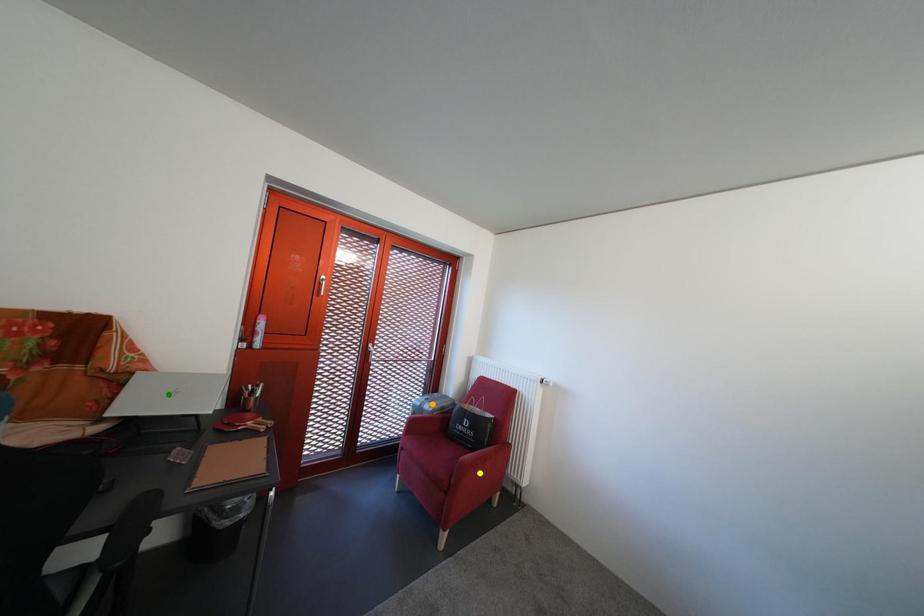
Order these from nearest to farthest:
- green point
- orange point
- yellow point

1. green point
2. yellow point
3. orange point